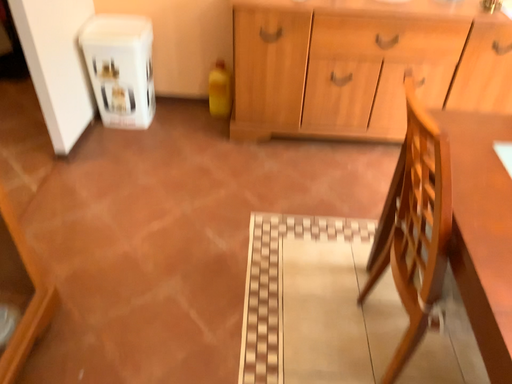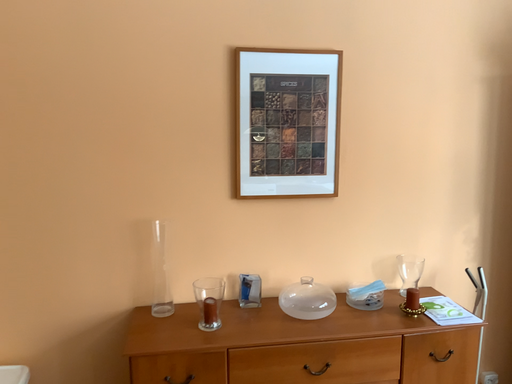
Question: Which way did the camera rotate in the video?

Choices:
 (A) rotated upward
 (B) rotated downward

Answer: (A)